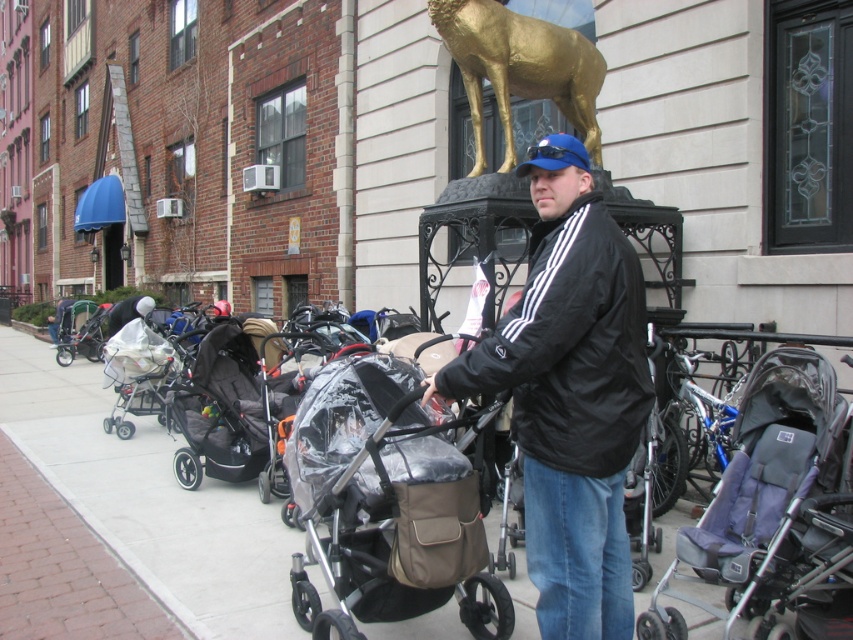
You are a delivery person trying to place a large package on the smooth concrete sidewalk at center. However, there is a clear plastic baby carriage at center in the way. Based on their sizes, can you determine if the sidewalk has enough space to accommodate the package without moving the carriage?

The smooth concrete sidewalk at center is shorter than the clear plastic baby carriage at center, meaning the sidewalk is not long enough to fit the package alongside the carriage. You would need to move the carriage to make space.

You are a delivery person trying to navigate through the sidewalk. You see a gray fabric stroller at center and a blue fabric baseball cap at center. Which object should you avoid to pass through safely?

The gray fabric stroller at center is wider than the blue fabric baseball cap at center, so you should avoid the gray fabric stroller at center to pass through safely.